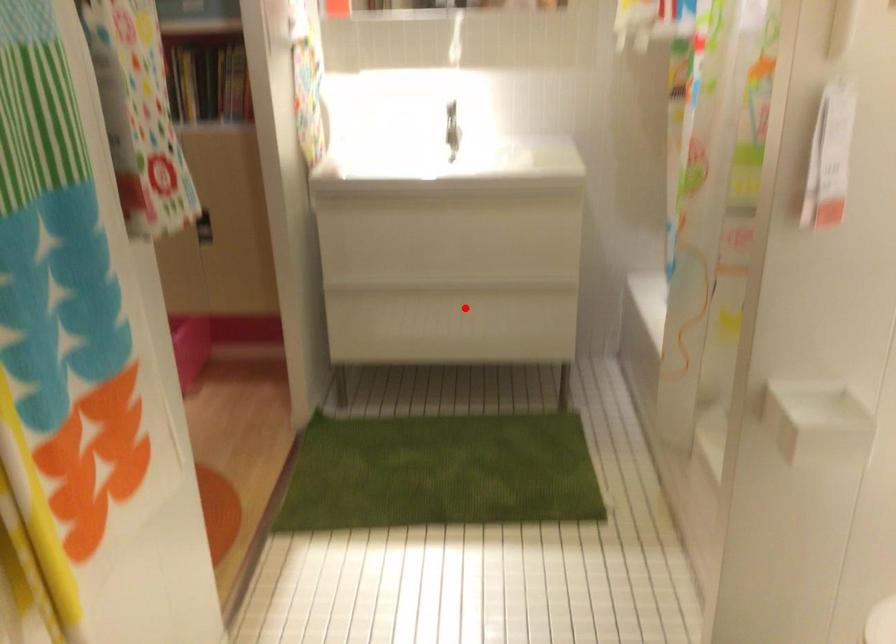
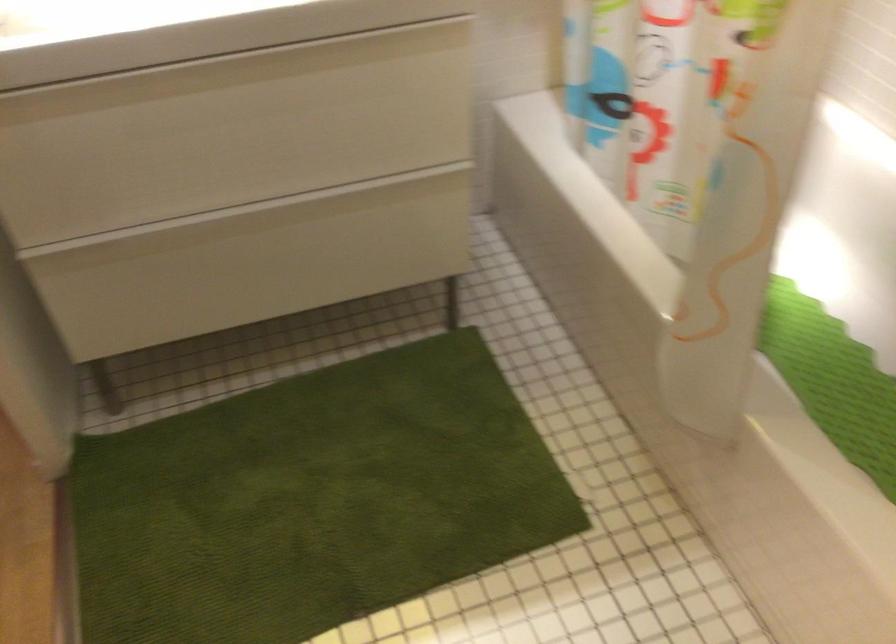
Question: I am providing you with two images of the same scene from different viewpoints. Given a red point in image1, look at the same physical point in image2. Is it:

Choices:
 (A) Closer to the viewpoint
 (B) Farther from the viewpoint

Answer: (A)